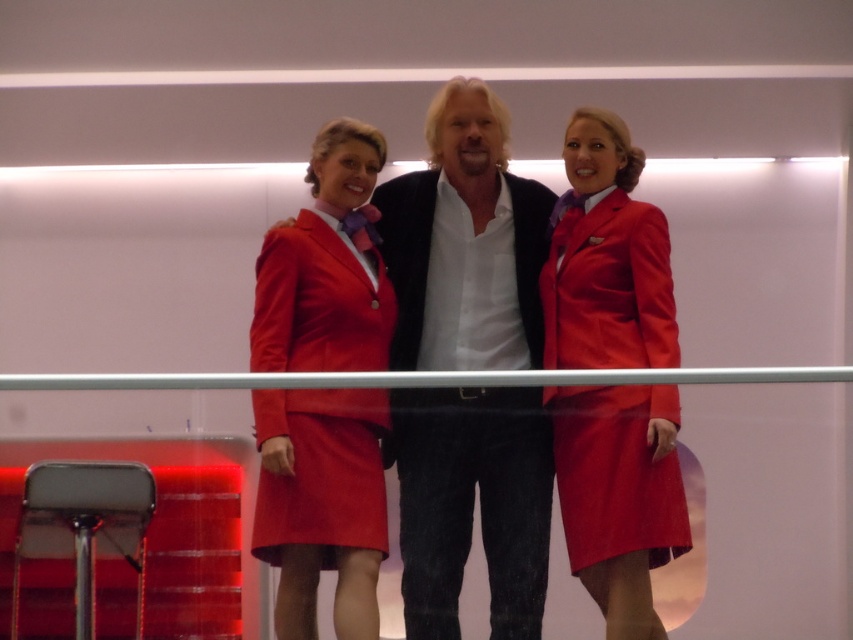
Question: Which point is farther to the camera?

Choices:
 (A) (358, 269)
 (B) (561, 282)
 (C) (407, 224)
 (D) (523, 513)

Answer: (C)

Question: Can you confirm if matte red uniform at center is positioned above matte red uniform at right?

Choices:
 (A) no
 (B) yes

Answer: (A)

Question: Which of the following is the closest to the observer?

Choices:
 (A) [296, 365]
 (B) [602, 184]
 (C) [486, 168]
 (D) [538, 426]

Answer: (D)

Question: From the image, what is the correct spatial relationship of matte red uniform at right in relation to matte red dress at center?

Choices:
 (A) left
 (B) right

Answer: (B)

Question: Which object is farther from the camera taking this photo?

Choices:
 (A) matte black shirt at center
 (B) matte red uniform at center

Answer: (A)

Question: Can you confirm if matte red uniform at center is wider than matte red uniform at right?

Choices:
 (A) yes
 (B) no

Answer: (A)